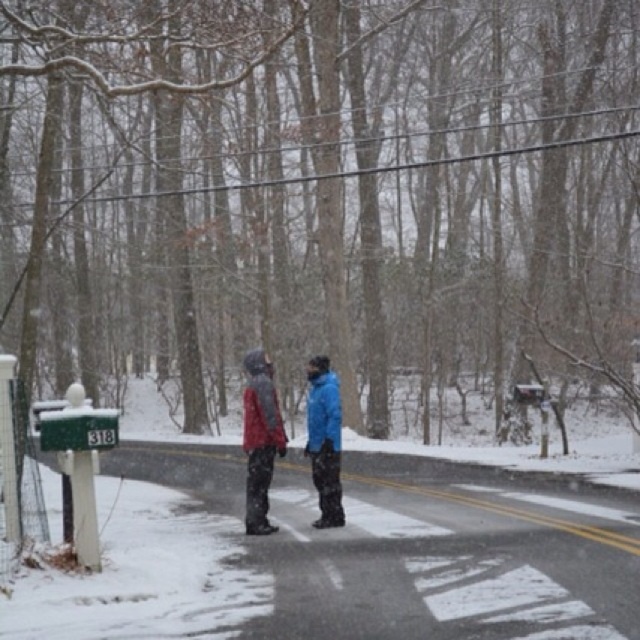
Question: Estimate the real-world distances between objects in this image. Which object is farther from the green painted metal mailbox at lower left?

Choices:
 (A) blue matte jacket at center
 (B) matte gray jacket at center

Answer: (A)

Question: Does green painted metal mailbox at lower left have a greater width compared to matte gray jacket at center?

Choices:
 (A) no
 (B) yes

Answer: (B)

Question: From the image, what is the correct spatial relationship of green painted metal mailbox at lower left in relation to matte gray jacket at center?

Choices:
 (A) below
 (B) above

Answer: (A)

Question: Can you confirm if matte blue jacket at center is bigger than green painted metal mailbox at lower left?

Choices:
 (A) yes
 (B) no

Answer: (B)

Question: Which object appears closest to the camera in this image?

Choices:
 (A) matte gray jacket at center
 (B) blue matte jacket at center
 (C) matte blue jacket at center
 (D) green painted metal mailbox at lower left

Answer: (D)

Question: Which object is farther from the camera taking this photo?

Choices:
 (A) green painted metal mailbox at lower left
 (B) matte blue jacket at center
 (C) matte gray jacket at center
 (D) blue matte jacket at center

Answer: (D)